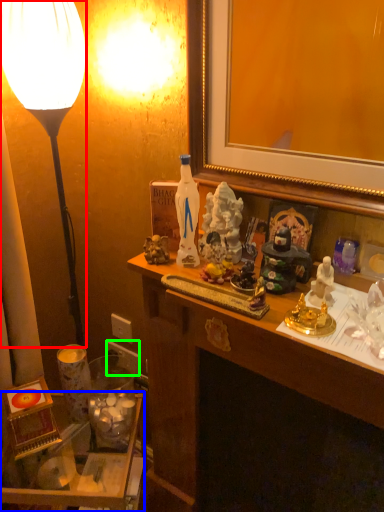
Question: Estimate the real-world distances between objects in this image. Which object is farther from lamp (highlighted by a red box), table (highlighted by a blue box) or power outlet (highlighted by a green box)?

Choices:
 (A) table
 (B) power outlet

Answer: (A)